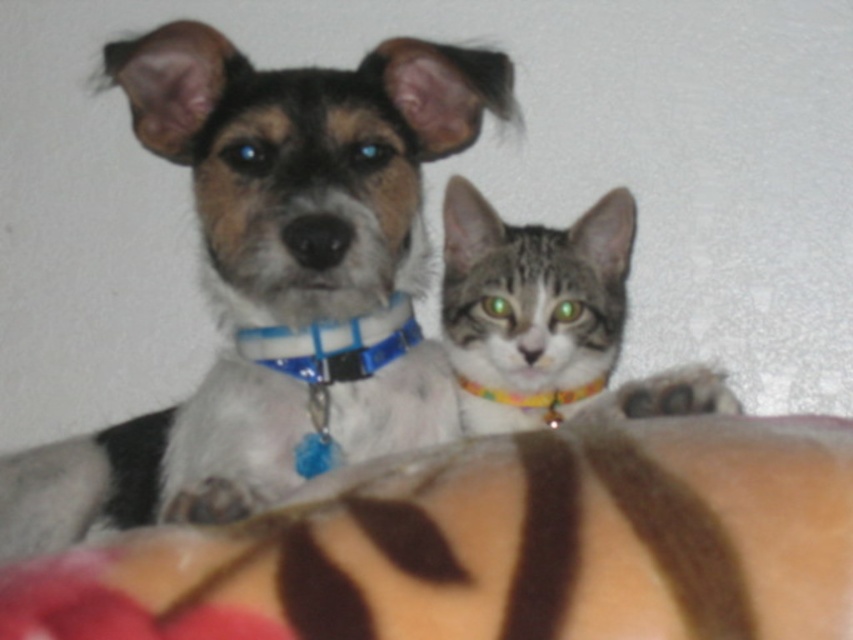
Is tabby fur cat at center smaller than blue plastic collar at center?

Actually, tabby fur cat at center might be larger than blue plastic collar at center.

Is tabby fur cat at center taller than blue plastic collar at center?

Indeed, tabby fur cat at center has a greater height compared to blue plastic collar at center.

Locate an element on the screen. This screenshot has height=640, width=853. tabby fur cat at center is located at coordinates point(532,308).

Who is positioned more to the right, blue plastic collar at center or multicolored fabric neckband at center?

From the viewer's perspective, multicolored fabric neckband at center appears more on the right side.

Can you confirm if blue plastic collar at center is smaller than multicolored fabric neckband at center?

No, blue plastic collar at center is not smaller than multicolored fabric neckband at center.

Find the location of a particular element. The image size is (853, 640). blue plastic collar at center is located at coordinates (334, 344).

Locate an element on the screen. This screenshot has height=640, width=853. blue plastic collar at center is located at coordinates (334, 344).

Identify the location of shiny blue collar at center. Image resolution: width=853 pixels, height=640 pixels. (276, 282).

Who is more distant from viewer, (x=328, y=180) or (x=332, y=371)?

The point (x=332, y=371) is behind.

Describe the element at coordinates (276, 282) in the screenshot. This screenshot has width=853, height=640. I see `shiny blue collar at center` at that location.

This screenshot has height=640, width=853. I want to click on shiny blue collar at center, so click(276, 282).